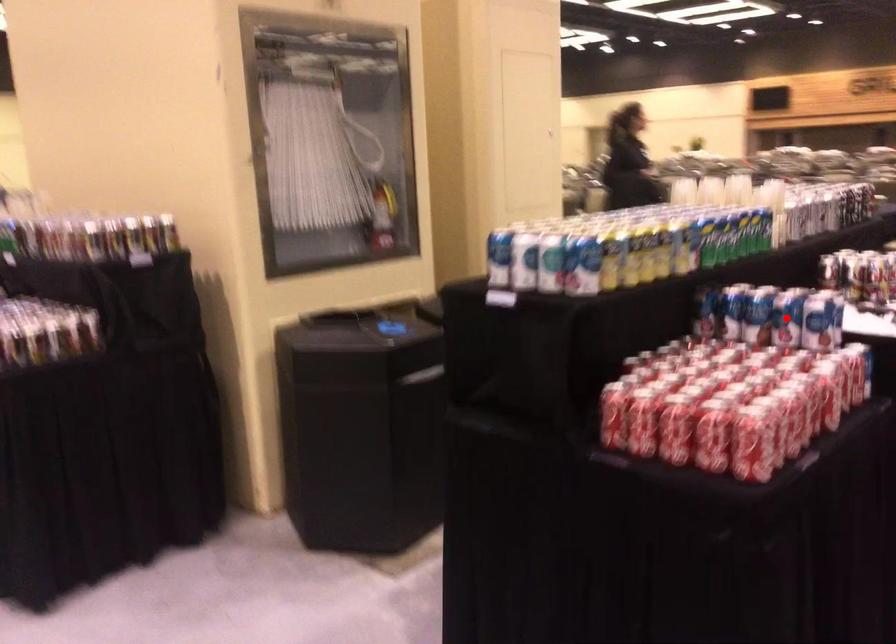
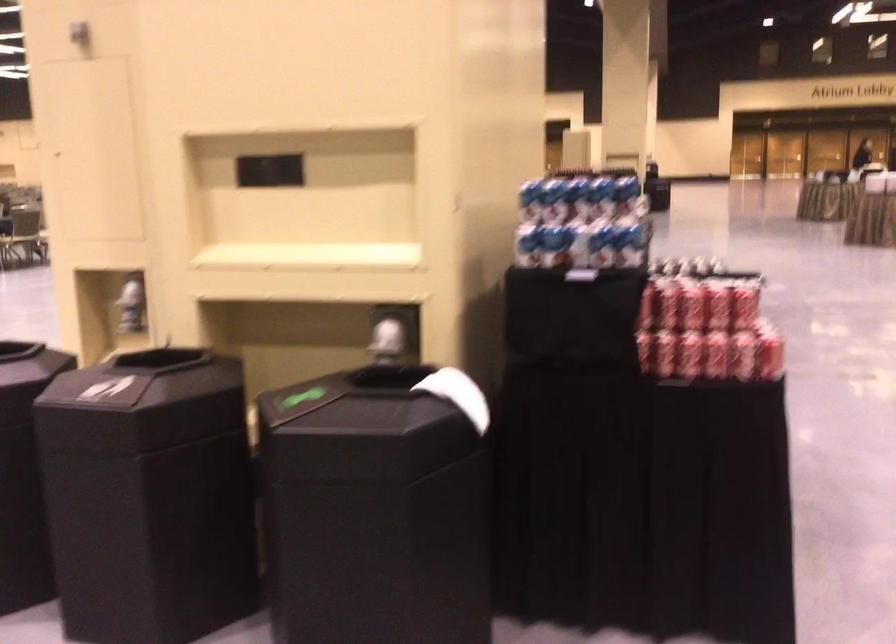
Question: I am providing you with two images of the same scene from different viewpoints. A red point is marked on the first image. Can you still see the location of the red point in image 2?

Choices:
 (A) Yes
 (B) No

Answer: (B)